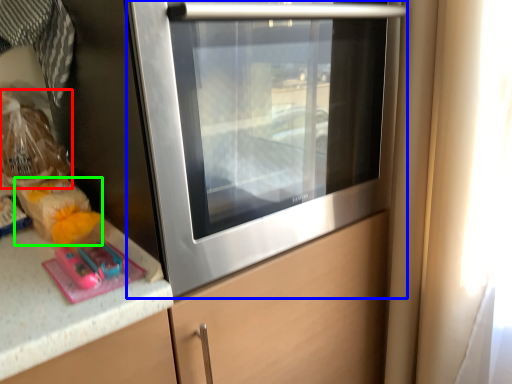
Question: Considering the real-world distances, which object is closest to food (highlighted by a red box)? home appliance (highlighted by a blue box) or food (highlighted by a green box).

Choices:
 (A) home appliance
 (B) food

Answer: (B)